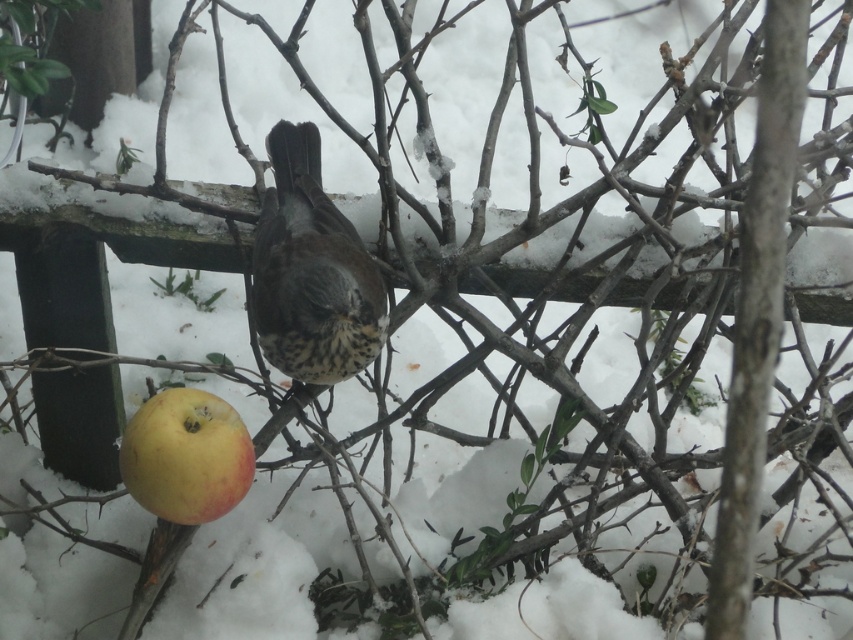
You are an ornithologist observing the speckled brown bird at center and the yellow matte apple at lower left in the image. Based on their sizes, which object would require a larger container if you were to transport them both separately?

The speckled brown bird at center might require a larger container than the yellow matte apple at lower left because it might be wider than the apple.